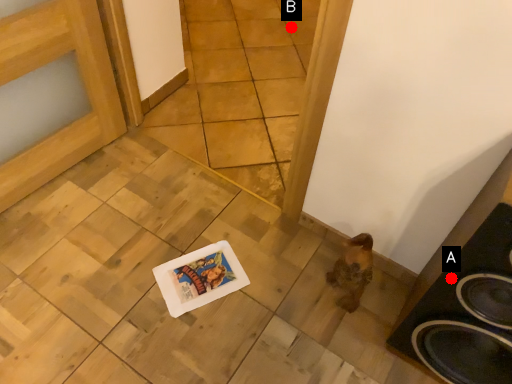
Question: Two points are circled on the image, labeled by A and B beside each circle. Which point is closer to the camera taking this photo?

Choices:
 (A) A is closer
 (B) B is closer

Answer: (A)